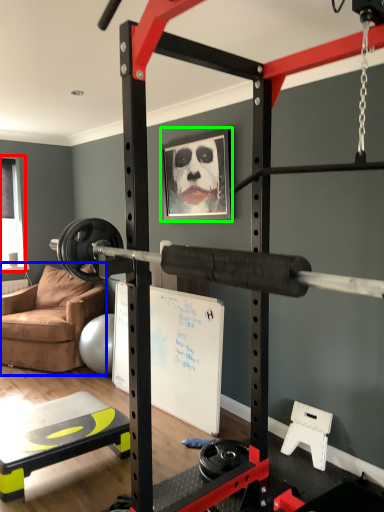
Question: Estimate the real-world distances between objects in this image. Which object is farther from window screen (highlighted by a red box), chair (highlighted by a blue box) or picture frame (highlighted by a green box)?

Choices:
 (A) chair
 (B) picture frame

Answer: (B)